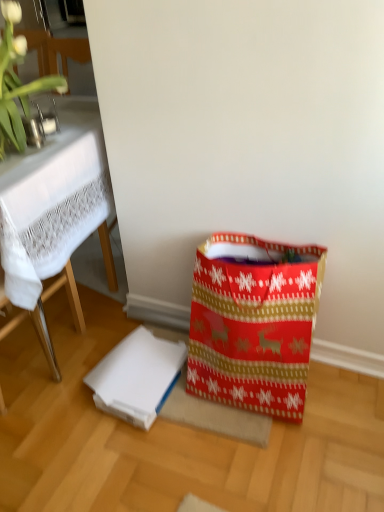
Find the location of a particular element. This screenshot has height=512, width=384. vacant area on top of white matte cardboard box at lower center (from a real-world perspective) is located at coordinates (145, 368).